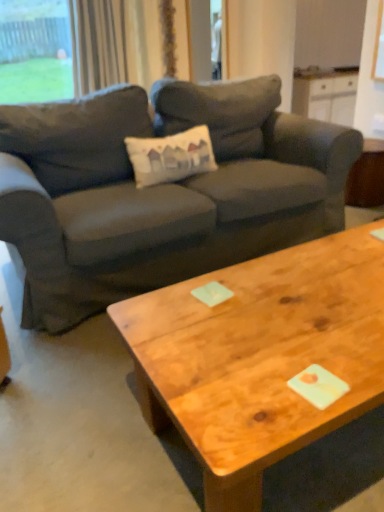
I want to click on green glass window at upper left, so click(34, 51).

Measure the distance between green glass window at upper left and camera.

4.46 meters.

The height and width of the screenshot is (512, 384). Describe the element at coordinates (97, 44) in the screenshot. I see `light beige fabric curtain at upper left` at that location.

The height and width of the screenshot is (512, 384). In order to click on green glass window at upper left in this screenshot , I will do `click(34, 51)`.

Is light beige fabric curtain at upper left turned away from wooden side table at right?

No, light beige fabric curtain at upper left's orientation is not away from wooden side table at right.

From a real-world perspective, is light beige fabric curtain at upper left above or below wooden side table at right?

From a real-world perspective, light beige fabric curtain at upper left is physically above wooden side table at right.

Considering the positions of objects light beige fabric curtain at upper left and wooden side table at right in the image provided, who is more to the left, light beige fabric curtain at upper left or wooden side table at right?

light beige fabric curtain at upper left is more to the left.

Can you tell me how much light beige fabric curtain at upper left and wooden side table at right differ in facing direction?

They differ by 87.5 degrees in their facing directions.

Does wooden coffee table at center come behind dark gray fabric couch at center?

No, wooden coffee table at center is in front of dark gray fabric couch at center.

Is wooden coffee table at center not close to dark gray fabric couch at center?

That's not correct — wooden coffee table at center is a little close to dark gray fabric couch at center.

From a real-world perspective, is wooden coffee table at center positioned above or below dark gray fabric couch at center?

Clearly, from a real-world perspective, wooden coffee table at center is below dark gray fabric couch at center.

Is wooden coffee table at center positioned with its back to light beige fabric curtain at upper left?

No, wooden coffee table at center is not facing away from light beige fabric curtain at upper left.

From a real-world perspective, is wooden coffee table at center beneath light beige fabric curtain at upper left?

Indeed, from a real-world perspective, wooden coffee table at center is positioned beneath light beige fabric curtain at upper left.

Considering the points (271, 461) and (164, 33), which point is in front, point (271, 461) or point (164, 33)?

The point (271, 461) is closer.

From the image's perspective, is light beige fabric curtain at upper left below dark gray fabric couch at center?

No, from the image's perspective, light beige fabric curtain at upper left is not beneath dark gray fabric couch at center.

Considering the points (94, 65) and (198, 197), which point is in front, point (94, 65) or point (198, 197)?

The point (198, 197) is more forward.

Measure the distance between light beige fabric curtain at upper left and dark gray fabric couch at center.

They are 5.74 feet apart.

Is light beige fabric curtain at upper left shorter than dark gray fabric couch at center?

Correct, light beige fabric curtain at upper left is not as tall as dark gray fabric couch at center.

Which object is more forward, wooden coffee table at center or green glass window at upper left?

Positioned in front is wooden coffee table at center.

Which of these two, wooden coffee table at center or green glass window at upper left, is thinner?

green glass window at upper left is thinner.

From a real-world perspective, is wooden coffee table at center positioned above or below green glass window at upper left?

From a real-world perspective, wooden coffee table at center is physically below green glass window at upper left.

Looking at this image, can you confirm if green glass window at upper left is bigger than wooden coffee table at center?

No.

Identify the location of coffee table on the right of green glass window at upper left. (260, 357).

Consider the image. Would you say green glass window at upper left is a long distance from wooden coffee table at center?

Yes, green glass window at upper left and wooden coffee table at center are quite far apart.

Is green glass window at upper left outside of wooden coffee table at center?

Yes, green glass window at upper left is not within wooden coffee table at center.

Considering the positions of objects wooden side table at right and green glass window at upper left in the image provided, who is more to the right, wooden side table at right or green glass window at upper left?

wooden side table at right is more to the right.

Which object is further away from the camera taking this photo, wooden side table at right or green glass window at upper left?

green glass window at upper left is more distant.

Locate an element on the screen. The height and width of the screenshot is (512, 384). curtain lying on the left of wooden side table at right is located at coordinates (97, 44).

The image size is (384, 512). Identify the location of studio couch located behind the wooden coffee table at center. (159, 192).

Considering their positions, is dark gray fabric couch at center positioned further to green glass window at upper left than wooden side table at right?

Among the two, wooden side table at right is located further to green glass window at upper left.

Based on their spatial positions, is wooden side table at right or dark gray fabric couch at center further from wooden coffee table at center?

wooden side table at right is positioned further to the anchor wooden coffee table at center.

From the image, which object appears to be nearer to dark gray fabric couch at center, wooden side table at right or green glass window at upper left?

wooden side table at right lies closer to dark gray fabric couch at center than the other object.

Which object lies further to the anchor point light beige fabric curtain at upper left, green glass window at upper left or wooden coffee table at center?

wooden coffee table at center lies further to light beige fabric curtain at upper left than the other object.

From the image, which object appears to be farther from wooden coffee table at center, green glass window at upper left or light beige fabric curtain at upper left?

green glass window at upper left.

Based on their spatial positions, is wooden side table at right or wooden coffee table at center further from dark gray fabric couch at center?

wooden side table at right is further to dark gray fabric couch at center.

Based on their spatial positions, is wooden side table at right or green glass window at upper left further from light beige fabric curtain at upper left?

Among the two, wooden side table at right is located further to light beige fabric curtain at upper left.

Based on their spatial positions, is green glass window at upper left or wooden side table at right further from wooden coffee table at center?

green glass window at upper left lies further to wooden coffee table at center than the other object.

Where is `studio couch between wooden coffee table at center and wooden side table at right along the z-axis`? The image size is (384, 512). studio couch between wooden coffee table at center and wooden side table at right along the z-axis is located at coordinates (159, 192).

You are a GUI agent. You are given a task and a screenshot of the screen. Output one action in this format:
    pyautogui.click(x=<x>, y=<y>)
    Task: Click on the side table between wooden coffee table at center and light beige fabric curtain at upper left from front to back
    The width and height of the screenshot is (384, 512).
    Given the screenshot: What is the action you would take?
    pyautogui.click(x=367, y=177)

This screenshot has height=512, width=384. I want to click on studio couch located between wooden coffee table at center and green glass window at upper left in the depth direction, so (x=159, y=192).

This screenshot has height=512, width=384. I want to click on curtain positioned between wooden coffee table at center and green glass window at upper left from near to far, so click(97, 44).